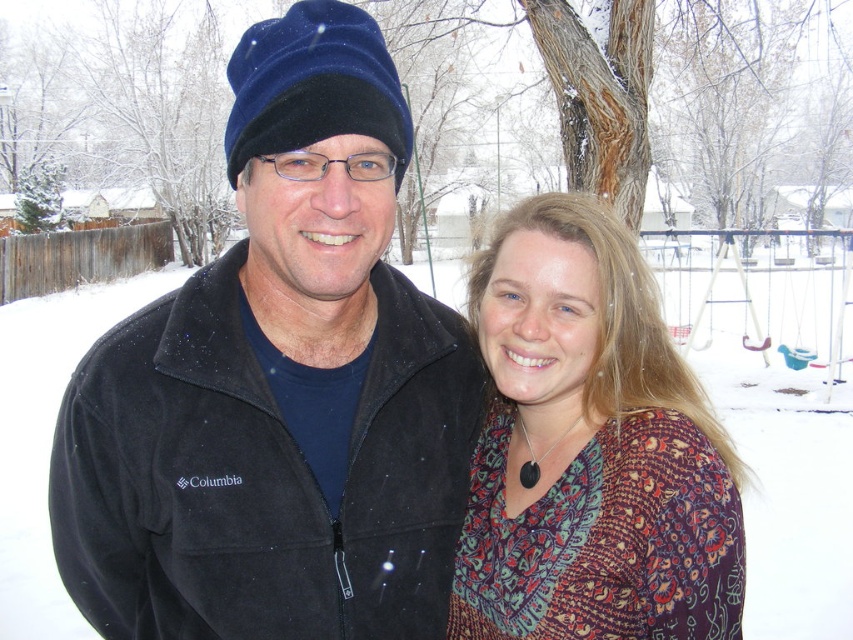
You are a photographer trying to capture a photo of the two people in the snowy scene. The suede jacket at center and the brown bark tree at upper center are both in your frame. Which object takes up more space in the photo?

The brown bark tree at upper center takes up more space in the photo than the suede jacket at center because the suede jacket at center occupies less space than brown bark tree at upper center.

You are taking a photo of the two points in the image. Which point, point (248, 531) or point (19, 148), is closer to the camera?

Point (248, 531) is closer to the camera than point (19, 148).

You are taking a photo of the two people in the snowy scene. The camera is focused on the patterned fabric blouse at center. To include the brown bark tree at upper center in the frame, should you pan the camera to the left or the right?

The brown bark tree at upper center is to the right of the patterned fabric blouse at center. Since the camera is focused on the blouse, you should pan the camera to the right to include the tree in the frame.